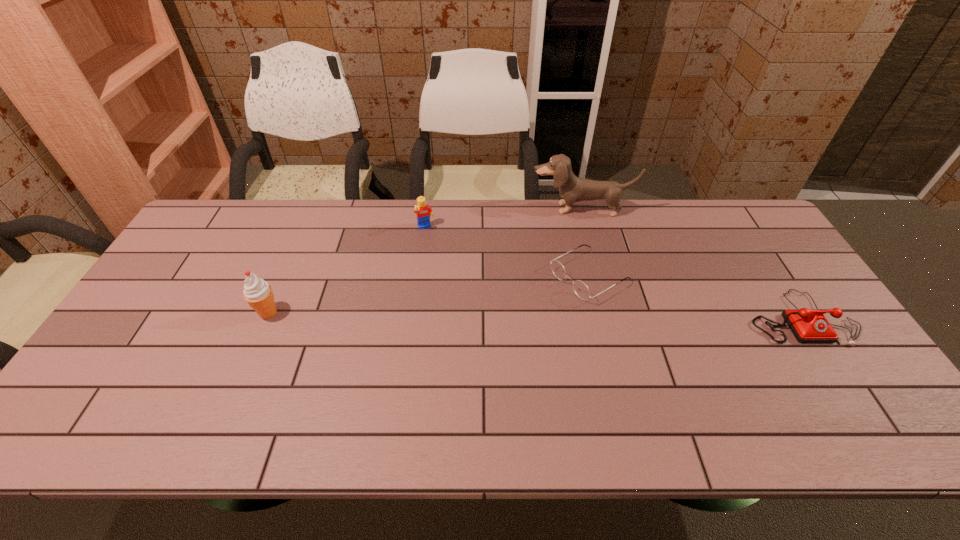
In order to click on free space on the desktop that is between the icecream and the second shortest object and is positioned on the face of the third tallest object in this screenshot , I will do `click(464, 315)`.

The image size is (960, 540). What are the coordinates of `free space on the desktop that is between the leftmost object and the rightmost object and is positioned at the face of the puppy` in the screenshot? It's located at (589, 315).

Find the location of `free spot on the desktop that is between the fourth shortest object and the second shortest object and is positioned on the front-facing side of the spectacles`. free spot on the desktop that is between the fourth shortest object and the second shortest object and is positioned on the front-facing side of the spectacles is located at coordinates (520, 315).